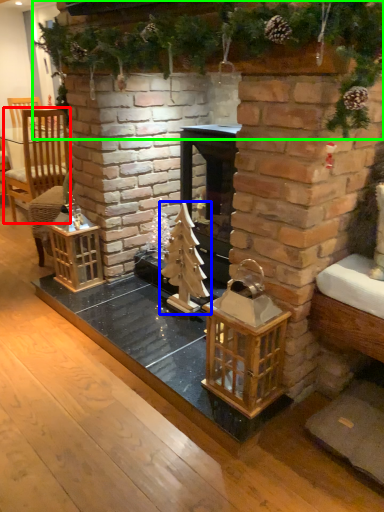
Question: Considering the real-world distances, which object is closest to armchair (highlighted by a red box)? christmas tree (highlighted by a blue box) or christmas decoration (highlighted by a green box).

Choices:
 (A) christmas tree
 (B) christmas decoration

Answer: (B)